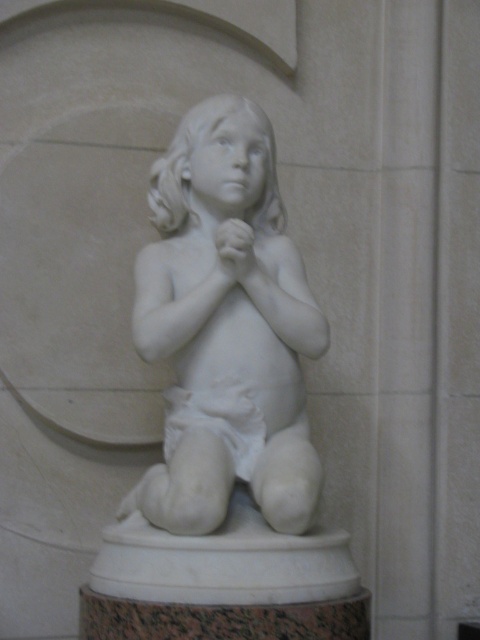
Looking at this image, you are an art conservator standing 6 feet away from the white marble statue at center. Can you reach out and touch the statue without moving closer?

The white marble statue at center is 5.64 feet away from camera, so yes, you can touch it without moving closer since you are standing 6 feet away, which is slightly farther than the statue distance.

You are an art conservator assessing the placement of the white marble statue at center and the white matte diaper at center. Which object would require a larger base to prevent tipping over?

The white marble statue at center is bigger than the white matte diaper at center, so it would require a larger base to prevent tipping over.